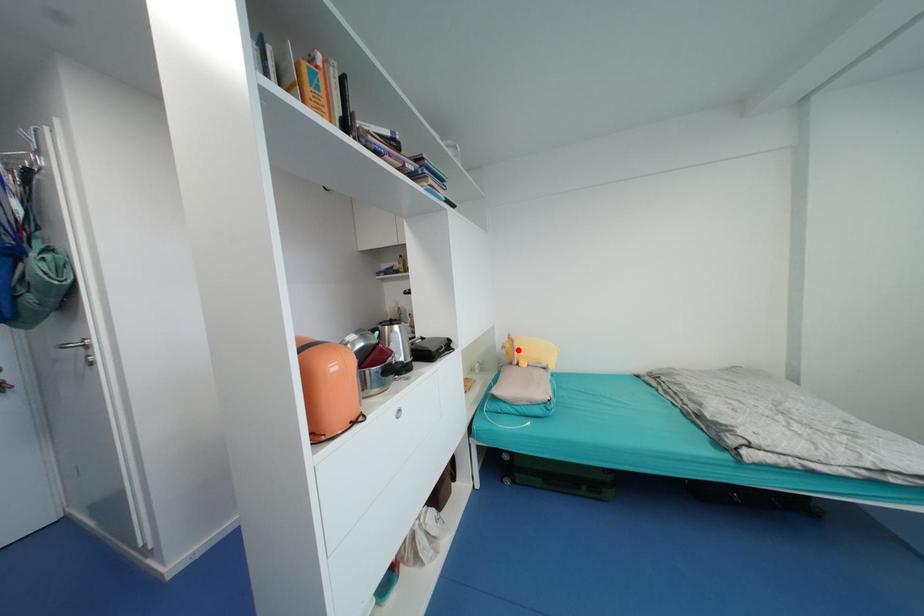
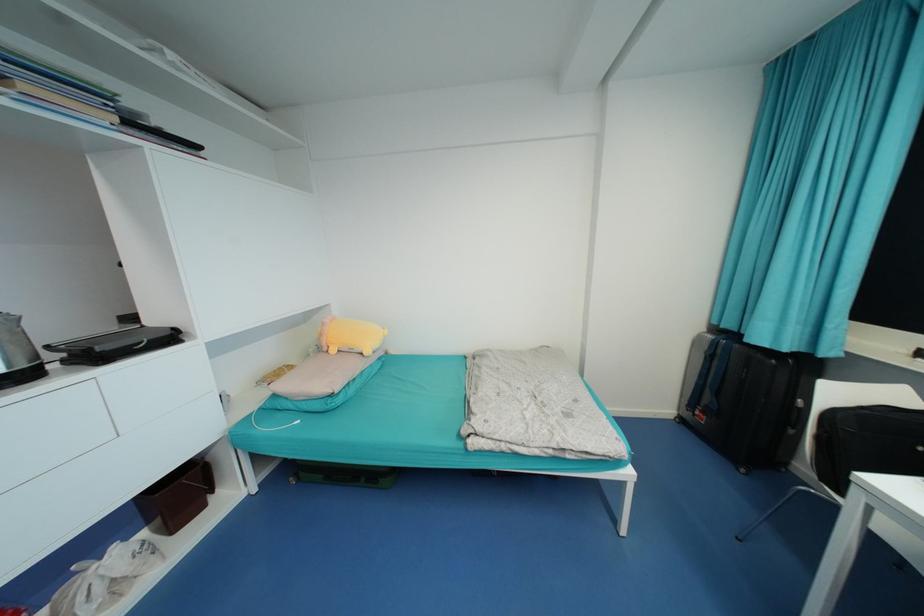
Where in the second image is the point corresponding to the highlighted location from the first image?

(325, 334)